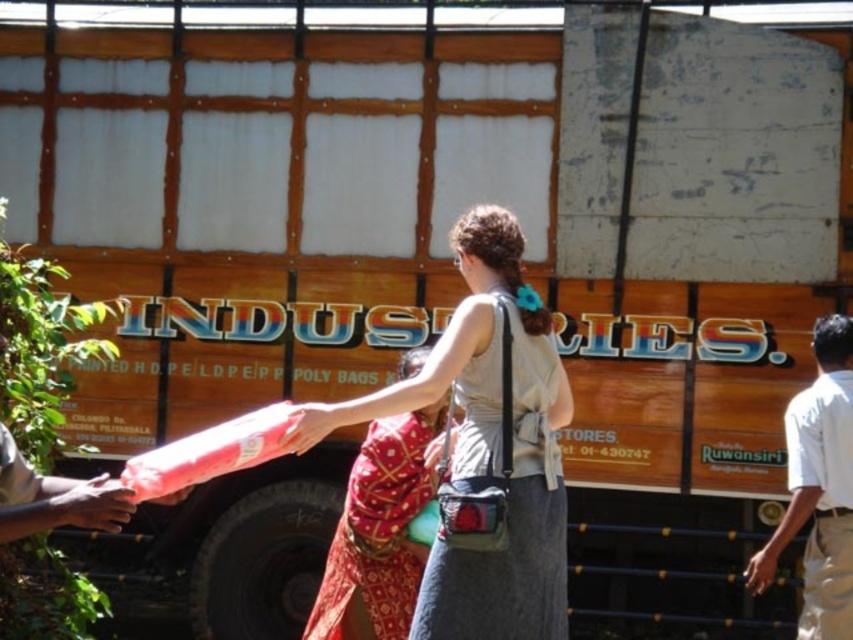
You are a delivery person who needs to hand over a package to the person at the scene. You see a smooth skin hand at lower left and a pink fabric at center. Which object should you place the package near to ensure it is easily visible and accessible for the recipient?

You should place the package near the smooth skin hand at lower left because it is closer to the recipient compared to the pink fabric at center, as they are 26.98 inches apart.

Please provide the 2D coordinates of the red printed pants at center in the image. The coordinates should be in the format of a tuple with two decimal numbers between 0 and 1, representing the x and y positions respectively. The x coordinate corresponds to the horizontal axis, and the y coordinate corresponds to the vertical axis. The origin is at the bottom left corner of the image.

The 2D coordinates of the red printed pants at center are at point (378, 532).